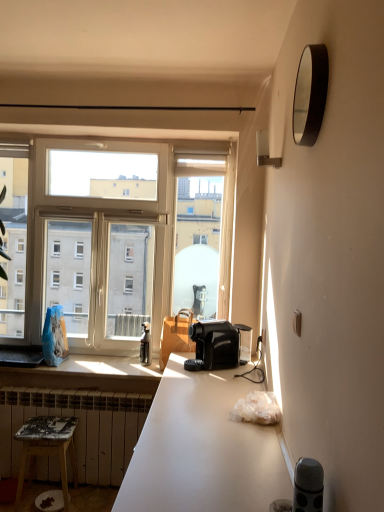
Question: From the image's perspective, is black glossy mirror at upper right positioned above or below black plastic coffee machine at center?

Choices:
 (A) below
 (B) above

Answer: (B)

Question: In terms of size, does black glossy mirror at upper right appear bigger or smaller than black plastic coffee machine at center?

Choices:
 (A) big
 (B) small

Answer: (B)

Question: Which object is positioned farthest from the white frosted glass wall sconce at upper right?

Choices:
 (A) black glossy mirror at upper right
 (B) black plastic coffee machine at center
 (C) white painted metal radiator at lower left
 (D) wooden stool at lower left
 (E) brown leather handbag at window

Answer: (D)

Question: Which object is the closest to the black matte speaker at lower right?

Choices:
 (A) clear glass window at center
 (B) brown leather handbag at window
 (C) wooden stool at lower left
 (D) black glossy mirror at upper right
 (E) black plastic coffee machine at center

Answer: (D)